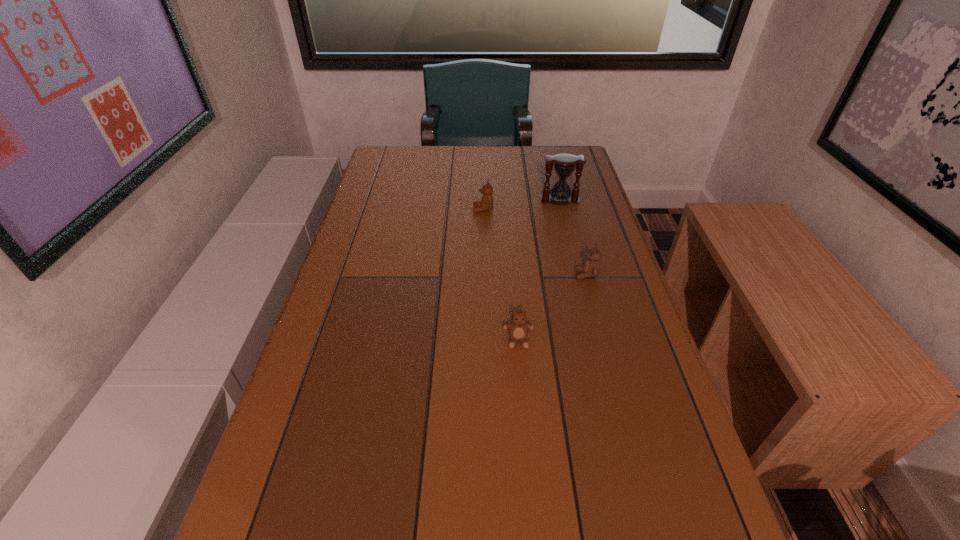
Identify which object is located as the third nearest to the tallest object. Please provide its 2D coordinates. Your answer should be formatted as a tuple, i.e. [(x, y)], where the tuple contains the x and y coordinates of a point satisfying the conditions above.

[(518, 329)]

Identify which object is the third nearest to the hourglass. Please provide its 2D coordinates. Your answer should be formatted as a tuple, i.e. [(x, y)], where the tuple contains the x and y coordinates of a point satisfying the conditions above.

[(518, 329)]

Locate an element on the screen. The width and height of the screenshot is (960, 540). the second closest teddy bear relative to the second nearest object is located at coordinates (486, 204).

Image resolution: width=960 pixels, height=540 pixels. I want to click on teddy bear that can be found as the closest to the nearest teddy bear, so click(591, 268).

Find the location of `vacant space that satisfies the following two spatial constraints: 1. on the front-facing side of the third farthest object; 2. on the front-facing side of the second teddy bear from left to right`. vacant space that satisfies the following two spatial constraints: 1. on the front-facing side of the third farthest object; 2. on the front-facing side of the second teddy bear from left to right is located at coordinates (604, 341).

You are a GUI agent. You are given a task and a screenshot of the screen. Output one action in this format:
    pyautogui.click(x=<x>, y=<y>)
    Task: Click on the free region that satisfies the following two spatial constraints: 1. on the front side of the hourglass; 2. on the face of the leftmost teddy bear
    
    Given the screenshot: What is the action you would take?
    pyautogui.click(x=563, y=210)

You are a GUI agent. You are given a task and a screenshot of the screen. Output one action in this format:
    pyautogui.click(x=<x>, y=<y>)
    Task: Click on the vacant position in the image that satisfies the following two spatial constraints: 1. on the front side of the hourglass; 2. on the face of the leftmost object
    This screenshot has width=960, height=540.
    Given the screenshot: What is the action you would take?
    pyautogui.click(x=563, y=210)